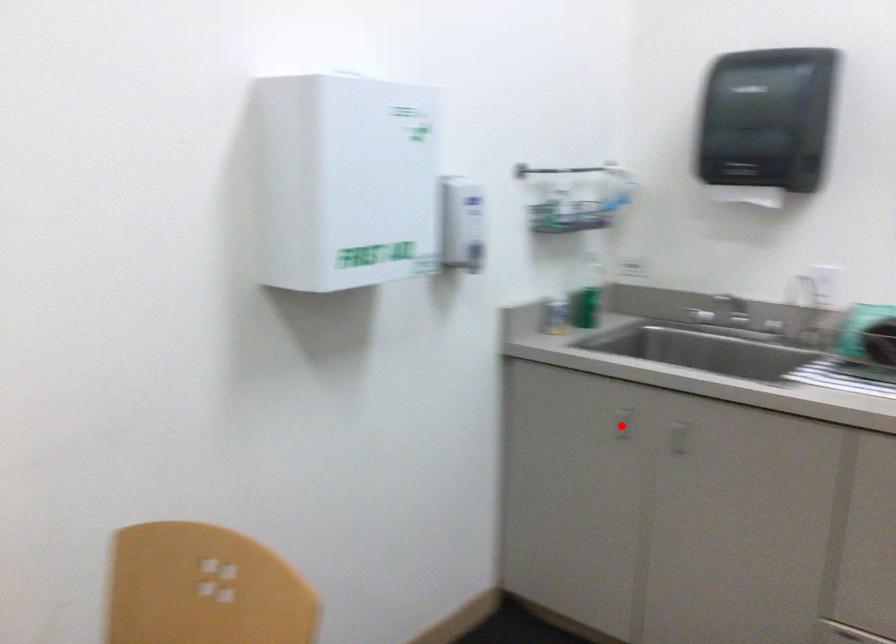
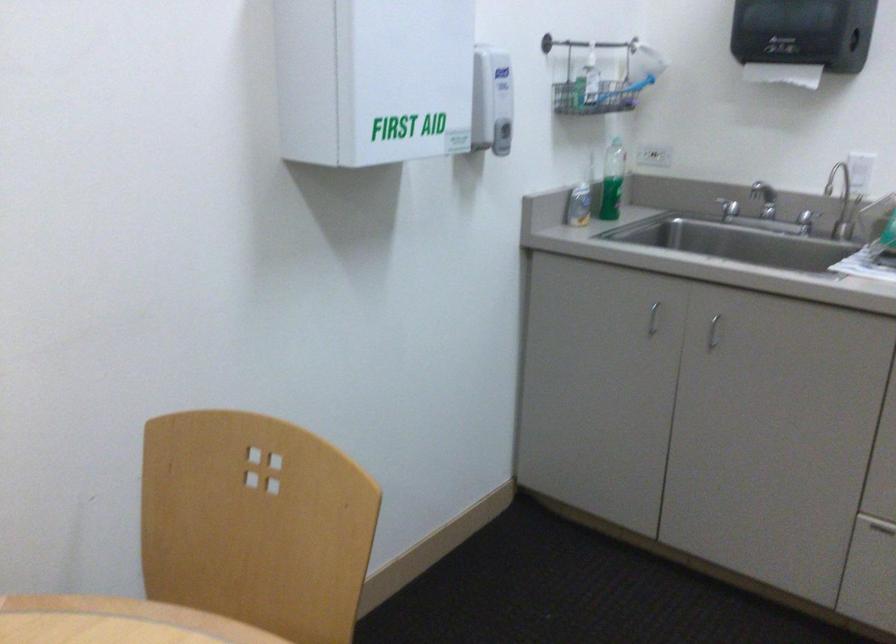
Find the pixel in the second image that matches the highlighted location in the first image.

(652, 319)